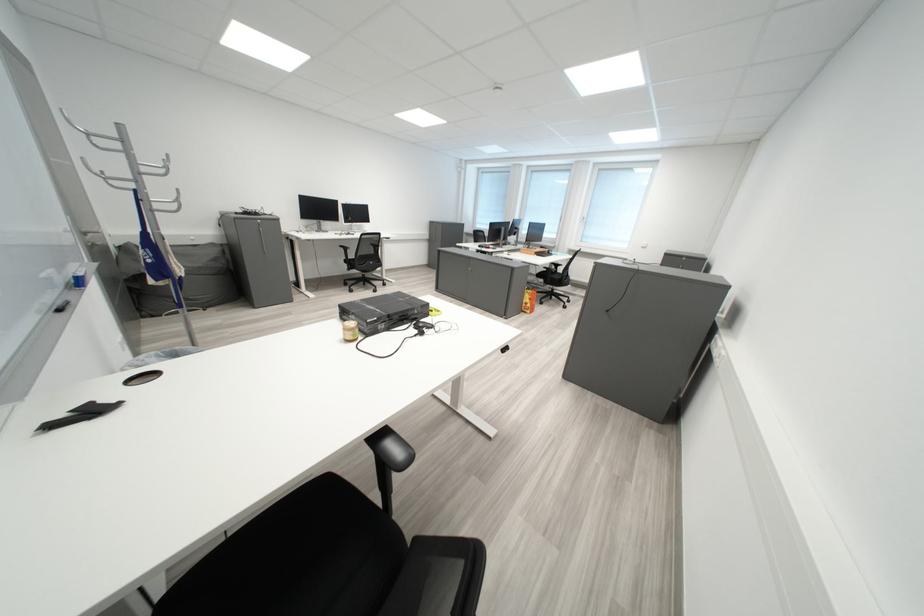
At what (x,y) coordinates should I click in order to perform the action: click on the top silver coat hook. Please return your answer as a coordinate pair (x, y). This screenshot has height=616, width=924. Looking at the image, I should click on (70, 121).